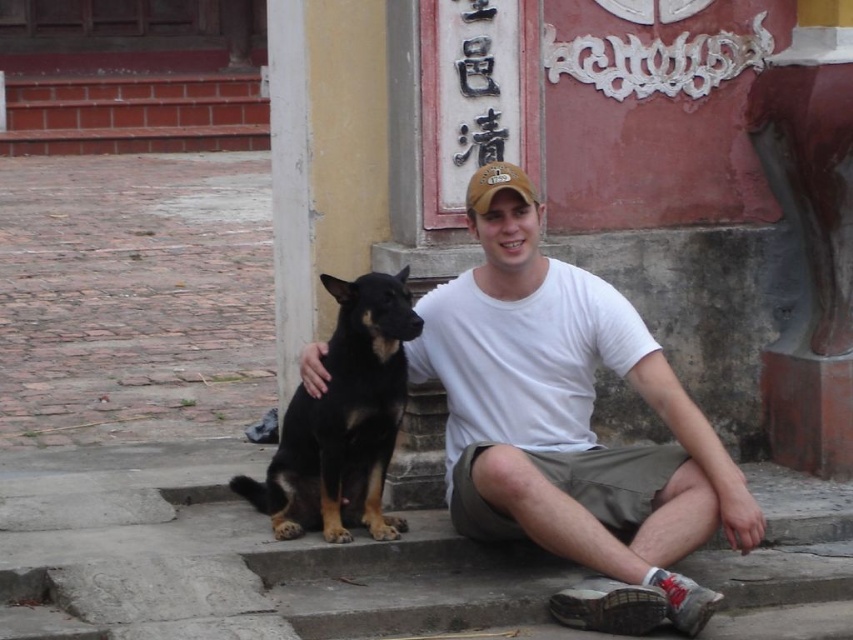
Question: Considering the real-world distances, which object is farthest from the white cotton t-shirt at center?

Choices:
 (A) gray concrete stairs at lower center
 (B) brown fabric cap at center

Answer: (B)

Question: Is gray concrete stairs at lower center bigger than black fur dog at center?

Choices:
 (A) no
 (B) yes

Answer: (A)

Question: Which of the following is the closest to the observer?

Choices:
 (A) gray concrete stairs at lower center
 (B) brown fabric cap at center
 (C) black fur dog at center

Answer: (A)

Question: Which of the following is the closest to the observer?

Choices:
 (A) white cotton t-shirt at center
 (B) gray concrete stairs at lower center
 (C) brown fabric cap at center

Answer: (A)

Question: Is gray concrete stairs at lower center positioned at the back of brown fabric cap at center?

Choices:
 (A) yes
 (B) no

Answer: (B)

Question: Can you confirm if white cotton t-shirt at center is smaller than brown fabric cap at center?

Choices:
 (A) yes
 (B) no

Answer: (B)